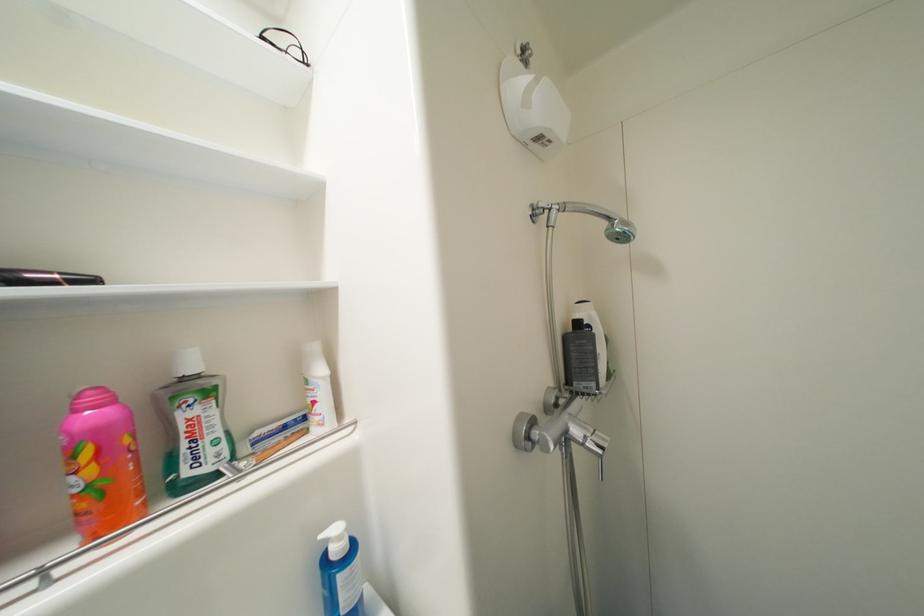
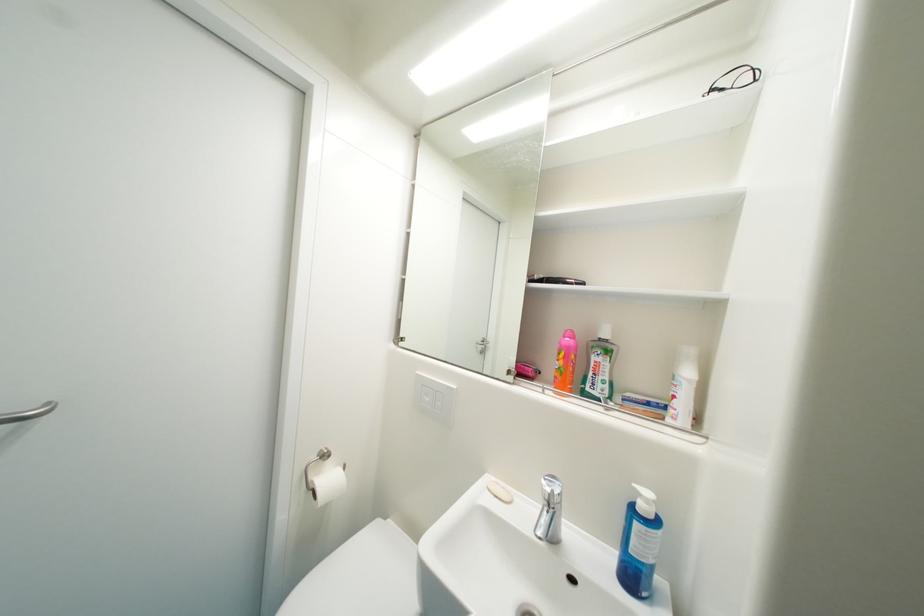
Locate, in the second image, the point that corresponds to (269,39) in the first image.

(718, 92)